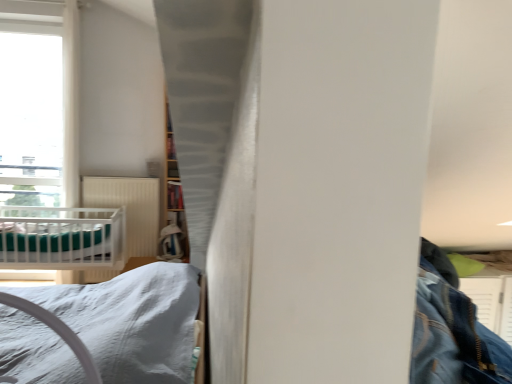
Question: Is white ribbed radiator at center bigger than white satin bed at lower left?

Choices:
 (A) no
 (B) yes

Answer: (B)

Question: Is white ribbed radiator at center positioned in front of white satin bed at lower left?

Choices:
 (A) yes
 (B) no

Answer: (B)

Question: Is white ribbed radiator at center looking in the opposite direction of white satin bed at lower left?

Choices:
 (A) no
 (B) yes

Answer: (A)

Question: From the image's perspective, would you say white ribbed radiator at center is positioned over white satin bed at lower left?

Choices:
 (A) no
 (B) yes

Answer: (B)

Question: Does white ribbed radiator at center have a greater height compared to white satin bed at lower left?

Choices:
 (A) no
 (B) yes

Answer: (B)

Question: Considering the relative sizes of white ribbed radiator at center and white satin bed at lower left in the image provided, is white ribbed radiator at center wider than white satin bed at lower left?

Choices:
 (A) yes
 (B) no

Answer: (B)

Question: From the image's perspective, is teal fabric sheet at left located beneath wooden bookshelf at center?

Choices:
 (A) no
 (B) yes

Answer: (B)

Question: Can you confirm if teal fabric sheet at left is positioned to the left of wooden bookshelf at center?

Choices:
 (A) yes
 (B) no

Answer: (A)

Question: Does teal fabric sheet at left lie in front of wooden bookshelf at center?

Choices:
 (A) yes
 (B) no

Answer: (A)

Question: Is teal fabric sheet at left further to the viewer compared to wooden bookshelf at center?

Choices:
 (A) yes
 (B) no

Answer: (B)

Question: Can you confirm if teal fabric sheet at left is wider than wooden bookshelf at center?

Choices:
 (A) no
 (B) yes

Answer: (B)

Question: Can you confirm if teal fabric sheet at left is bigger than wooden bookshelf at center?

Choices:
 (A) yes
 (B) no

Answer: (A)

Question: From a real-world perspective, is white ribbed radiator at center under wooden bookshelf at center?

Choices:
 (A) yes
 (B) no

Answer: (A)